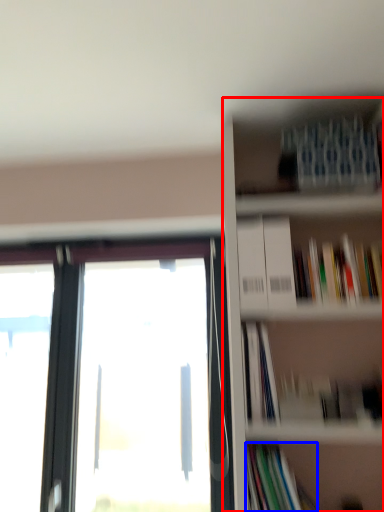
Question: Which object appears closest to the camera in this image, bookcase (highlighted by a red box) or book (highlighted by a blue box)?

Choices:
 (A) bookcase
 (B) book

Answer: (A)